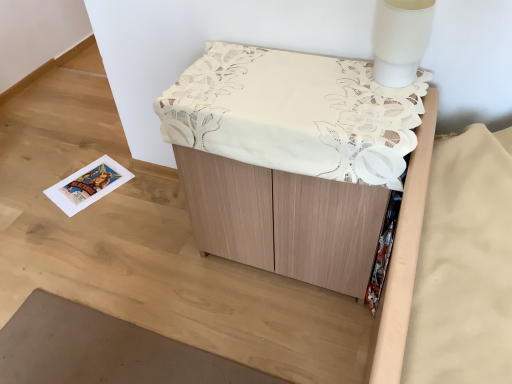
Question: Is white matte table lamp at upper right wider than wooden cabinet at center?

Choices:
 (A) yes
 (B) no

Answer: (B)

Question: From the image's perspective, would you say white matte table lamp at upper right is positioned over wooden cabinet at center?

Choices:
 (A) yes
 (B) no

Answer: (A)

Question: Considering the relative sizes of white matte table lamp at upper right and wooden cabinet at center in the image provided, is white matte table lamp at upper right thinner than wooden cabinet at center?

Choices:
 (A) no
 (B) yes

Answer: (B)

Question: Is white matte table lamp at upper right not within wooden cabinet at center?

Choices:
 (A) no
 (B) yes

Answer: (B)

Question: From the image's perspective, is white matte table lamp at upper right below wooden cabinet at center?

Choices:
 (A) yes
 (B) no

Answer: (B)

Question: Is wooden cabinet at center a part of white matte table lamp at upper right?

Choices:
 (A) no
 (B) yes

Answer: (A)

Question: Is wooden cabinet at center oriented towards white matte table lamp at upper right?

Choices:
 (A) no
 (B) yes

Answer: (A)

Question: From a real-world perspective, is wooden cabinet at center on top of white matte table lamp at upper right?

Choices:
 (A) yes
 (B) no

Answer: (B)

Question: Does wooden cabinet at center have a larger size compared to white matte table lamp at upper right?

Choices:
 (A) yes
 (B) no

Answer: (A)

Question: Is wooden cabinet at center directly adjacent to white matte table lamp at upper right?

Choices:
 (A) yes
 (B) no

Answer: (B)

Question: From the image's perspective, would you say wooden cabinet at center is shown under white matte table lamp at upper right?

Choices:
 (A) yes
 (B) no

Answer: (A)

Question: From the image's perspective, does wooden cabinet at center appear higher than white matte table lamp at upper right?

Choices:
 (A) yes
 (B) no

Answer: (B)

Question: Is white matte table lamp at upper right to the left or to the right of wooden cabinet at center in the image?

Choices:
 (A) right
 (B) left

Answer: (A)